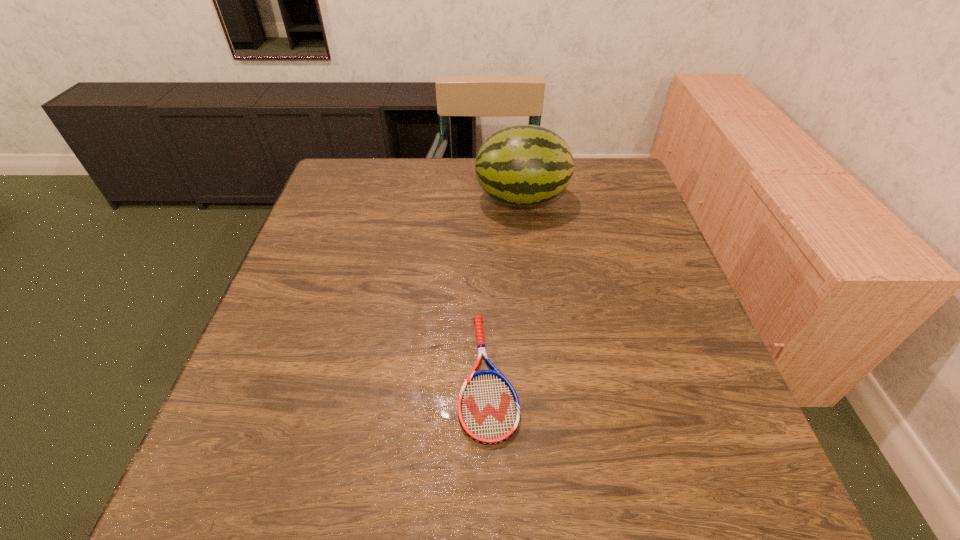
The image size is (960, 540). I want to click on vacant area at the near edge, so click(x=645, y=464).

At what (x,y) coordinates should I click in order to perform the action: click on vacant position at the left edge of the desktop. Please return your answer as a coordinate pair (x, y). Looking at the image, I should click on (276, 299).

Find the location of a particular element. The height and width of the screenshot is (540, 960). vacant space at the right edge of the desktop is located at coordinates (636, 291).

Find the location of a particular element. vacant point at the far right corner is located at coordinates (577, 169).

Identify the location of blank area at the near right corner. The height and width of the screenshot is (540, 960). (708, 482).

Locate an element on the screen. This screenshot has height=540, width=960. vacant point that satisfies the following two spatial constraints: 1. at the stem end of the taller object; 2. on the front side of the shorter object is located at coordinates (541, 375).